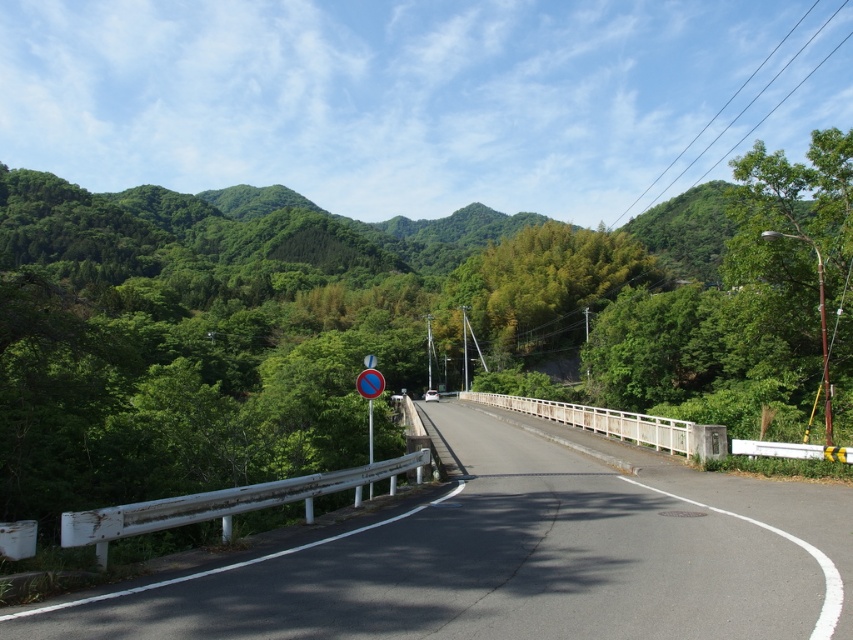
Looking at this image, can you confirm if green leafy tree at right is positioned to the left of blue glossy sign at center?

No, green leafy tree at right is not to the left of blue glossy sign at center.

Who is more forward, (x=740, y=193) or (x=360, y=387)?

Point (x=360, y=387) is in front.

Which is behind, point (769, 292) or point (379, 384)?

The point (769, 292) is more distant.

Find the location of a particular element. green leafy tree at right is located at coordinates (795, 262).

Does smooth asphalt highway at center have a lesser height compared to white metal guardrail at lower left?

Incorrect, smooth asphalt highway at center's height does not fall short of white metal guardrail at lower left's.

Does smooth asphalt highway at center appear over white metal guardrail at lower left?

No.

Does point (630, 605) come behind point (309, 508)?

No.

Identify the location of smooth asphalt highway at center. (515, 560).

Between smooth asphalt highway at center and green leafy tree at right, which one is positioned higher?

green leafy tree at right is above.

Between smooth asphalt highway at center and green leafy tree at right, which one appears on the right side from the viewer's perspective?

From the viewer's perspective, green leafy tree at right appears more on the right side.

Who is more distant from viewer, (378,611) or (746,220)?

Positioned behind is point (746,220).

Identify the location of smooth asphalt highway at center. Image resolution: width=853 pixels, height=640 pixels. (515, 560).